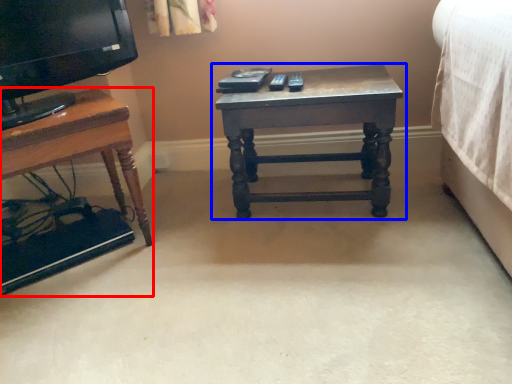
Question: Which object is further to the camera taking this photo, table (highlighted by a red box) or table (highlighted by a blue box)?

Choices:
 (A) table
 (B) table

Answer: (B)